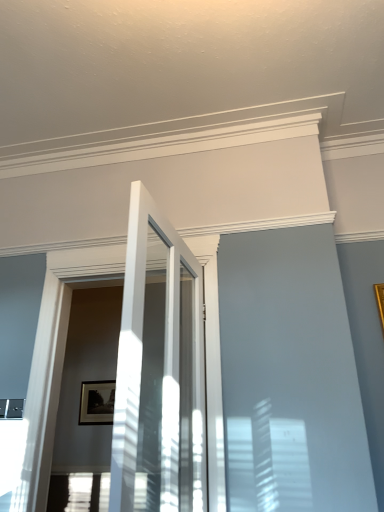
Question: Considering the relative sizes of matte black picture frame at center and white glossy door at center in the image provided, is matte black picture frame at center thinner than white glossy door at center?

Choices:
 (A) yes
 (B) no

Answer: (A)

Question: Considering the relative positions of matte black picture frame at center and white glossy door at center in the image provided, is matte black picture frame at center in front of white glossy door at center?

Choices:
 (A) no
 (B) yes

Answer: (A)

Question: Considering the relative positions of matte black picture frame at center and white glossy door at center in the image provided, is matte black picture frame at center to the right of white glossy door at center from the viewer's perspective?

Choices:
 (A) yes
 (B) no

Answer: (B)

Question: Is matte black picture frame at center far from white glossy door at center?

Choices:
 (A) no
 (B) yes

Answer: (B)

Question: Can you confirm if matte black picture frame at center is shorter than white glossy door at center?

Choices:
 (A) no
 (B) yes

Answer: (B)

Question: Can you confirm if matte black picture frame at center is positioned to the left of white glossy door at center?

Choices:
 (A) yes
 (B) no

Answer: (A)

Question: Is white glossy door at center positioned before matte black picture frame at center?

Choices:
 (A) no
 (B) yes

Answer: (B)

Question: Is white glossy door at center in contact with matte black picture frame at center?

Choices:
 (A) yes
 (B) no

Answer: (B)

Question: Is matte black picture frame at center located within white glossy door at center?

Choices:
 (A) yes
 (B) no

Answer: (B)

Question: From the image's perspective, is white glossy door at center above matte black picture frame at center?

Choices:
 (A) no
 (B) yes

Answer: (B)

Question: Is white glossy door at center outside of matte black picture frame at center?

Choices:
 (A) yes
 (B) no

Answer: (A)

Question: From a real-world perspective, is white glossy door at center located beneath matte black picture frame at center?

Choices:
 (A) no
 (B) yes

Answer: (B)

Question: From the image's perspective, is matte black picture frame at center located above or below white glossy door at center?

Choices:
 (A) above
 (B) below

Answer: (B)